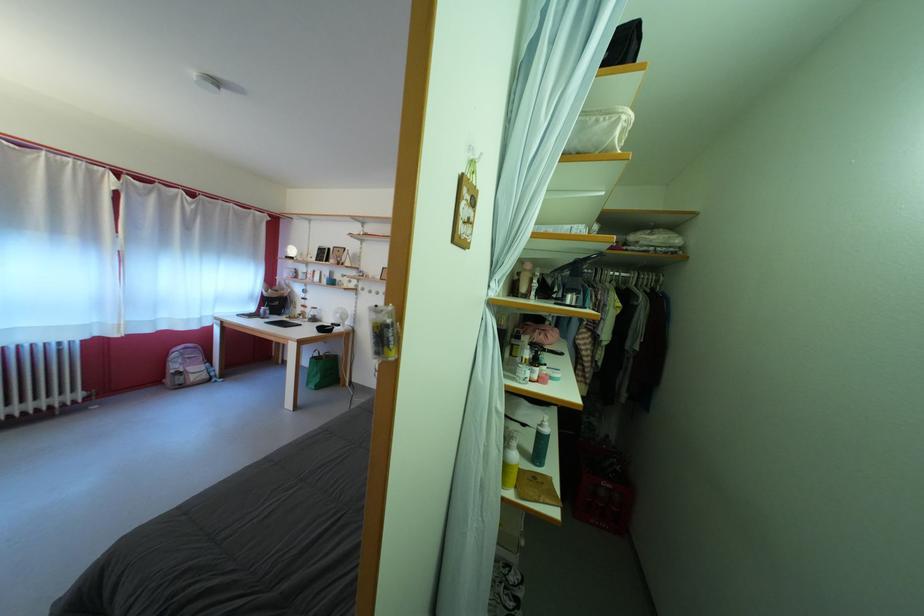
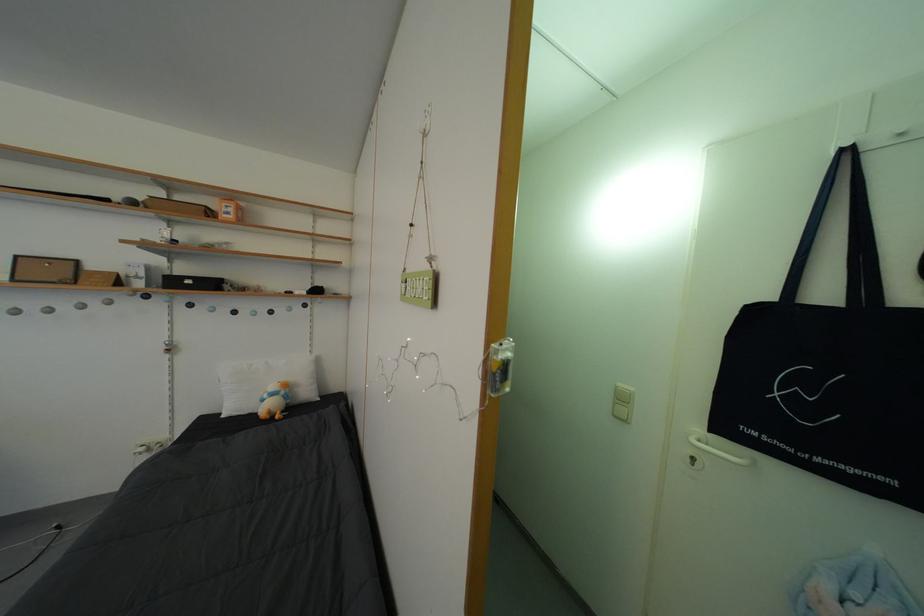
Question: The camera is either moving clockwise (left) or counter-clockwise (right) around the object. The first image is from the beginning of the video and the second image is from the end. Is the camera moving left or right when shooting the video?

Choices:
 (A) Left
 (B) Right

Answer: (A)